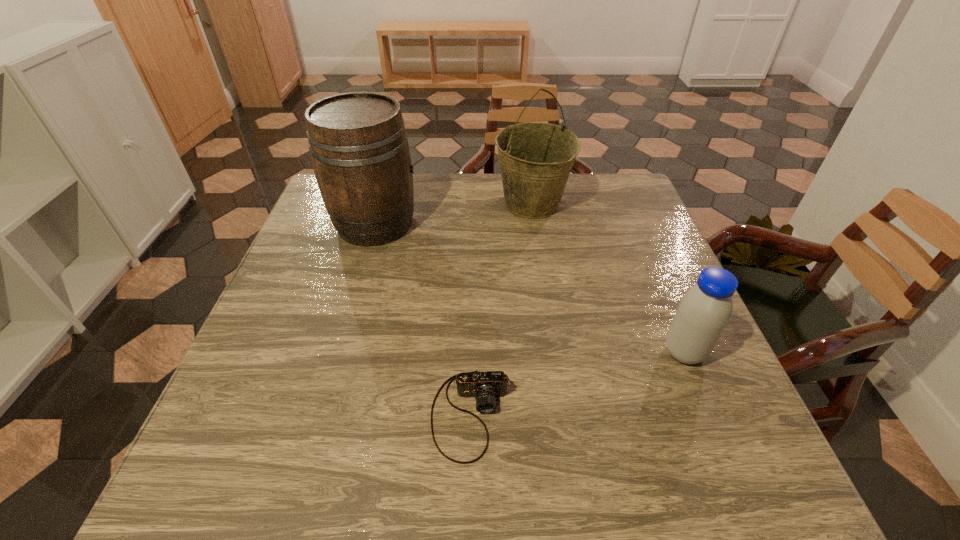
Identify the location of empty space between the wine bucket and the cider. (453, 214).

Where is `free spot between the cider and the wine bucket`? Image resolution: width=960 pixels, height=540 pixels. free spot between the cider and the wine bucket is located at coordinates (453, 214).

At what (x,y) coordinates should I click in order to perform the action: click on vacant space in between the leftmost object and the wine bucket. Please return your answer as a coordinate pair (x, y). Looking at the image, I should click on (453, 214).

This screenshot has width=960, height=540. I want to click on free space between the leftmost object and the wine bucket, so click(453, 214).

The height and width of the screenshot is (540, 960). What are the coordinates of `free space between the wine bucket and the second nearest object` in the screenshot? It's located at (608, 278).

You are a GUI agent. You are given a task and a screenshot of the screen. Output one action in this format:
    pyautogui.click(x=<x>, y=<y>)
    Task: Click on the free space between the cider and the soya milk
    Image resolution: width=960 pixels, height=540 pixels.
    Given the screenshot: What is the action you would take?
    pyautogui.click(x=530, y=288)

You are a GUI agent. You are given a task and a screenshot of the screen. Output one action in this format:
    pyautogui.click(x=<x>, y=<y>)
    Task: Click on the empty space between the third farthest object and the nearest object
    Image resolution: width=960 pixels, height=540 pixels.
    Given the screenshot: What is the action you would take?
    (578, 384)

Find the location of a particular element. This screenshot has width=960, height=540. free spot between the nearest object and the rightmost object is located at coordinates (578, 384).

The height and width of the screenshot is (540, 960). I want to click on free point between the wine bucket and the rightmost object, so click(x=608, y=278).

Where is `vacant area that lies between the cider and the wine bucket`? vacant area that lies between the cider and the wine bucket is located at coordinates (453, 214).